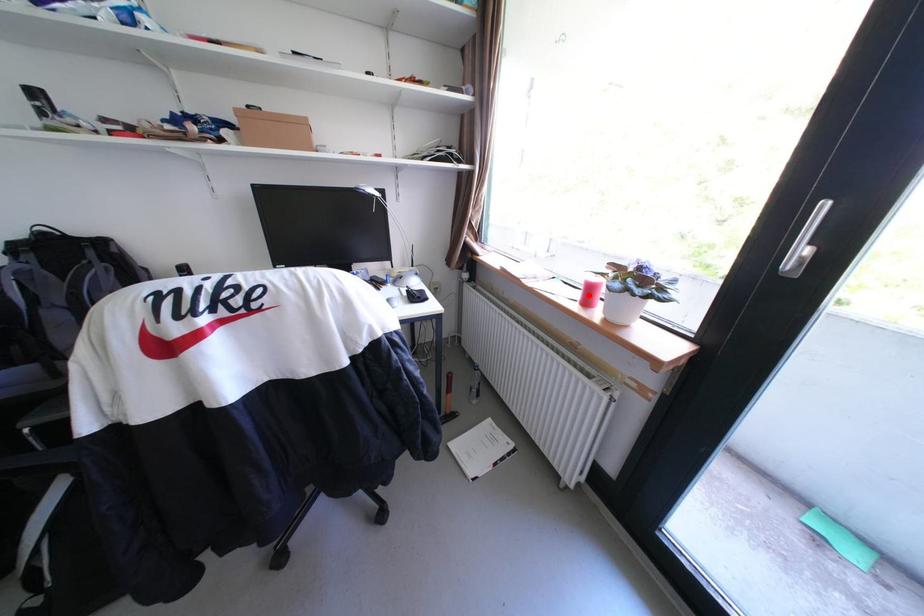
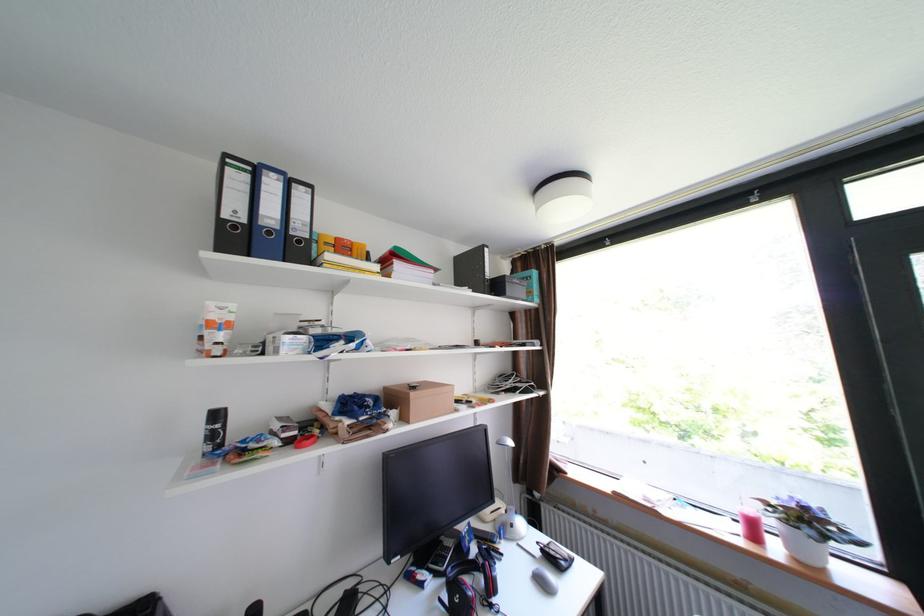
The point at the highlighted location is marked in the first image. Where is the corresponding point in the second image?

(749, 530)